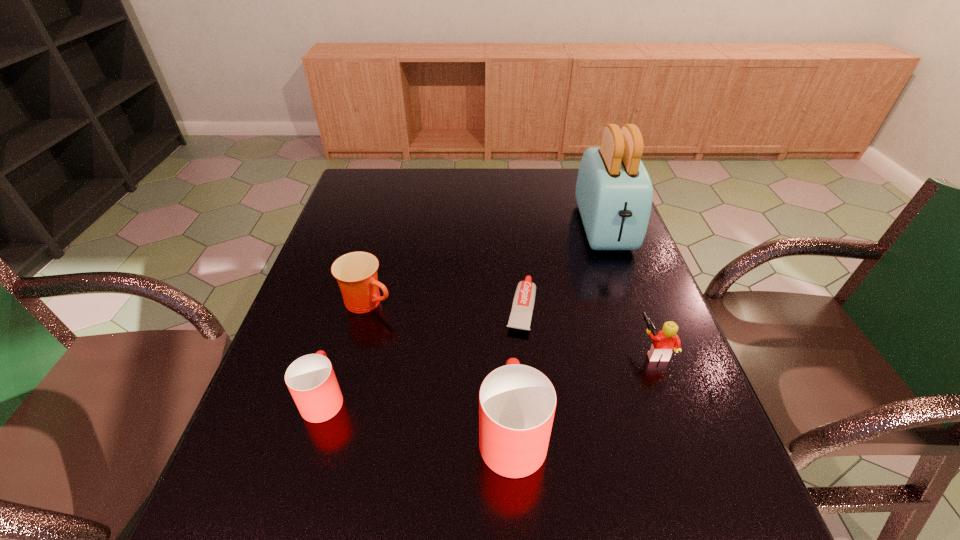
Locate an element on the screen. free area in between the toothpaste and the fourth farthest object is located at coordinates (588, 329).

Locate an element on the screen. blank region between the toothpaste and the farthest cup is located at coordinates (444, 305).

Where is `free spot between the fourth farthest object and the toaster`? This screenshot has width=960, height=540. free spot between the fourth farthest object and the toaster is located at coordinates point(630,289).

The height and width of the screenshot is (540, 960). In order to click on free space between the tallest cup and the farthest cup in this screenshot , I will do `click(441, 367)`.

Locate an element on the screen. The width and height of the screenshot is (960, 540). object that is the fifth closest to the Lego is located at coordinates (311, 380).

Image resolution: width=960 pixels, height=540 pixels. Identify the location of the second closest object to the farthest object. (664, 342).

What are the coordinates of `cup that can be found as the second closest to the rightmost cup` in the screenshot? It's located at (356, 272).

Find the location of `cup that is the closest to the farthest cup`. cup that is the closest to the farthest cup is located at coordinates (311, 380).

Where is `vacant space that satisfies the following two spatial constraints: 1. on the side of the rightmost cup with the handle; 2. on the left side of the toothpaste`? Image resolution: width=960 pixels, height=540 pixels. vacant space that satisfies the following two spatial constraints: 1. on the side of the rightmost cup with the handle; 2. on the left side of the toothpaste is located at coordinates (505, 307).